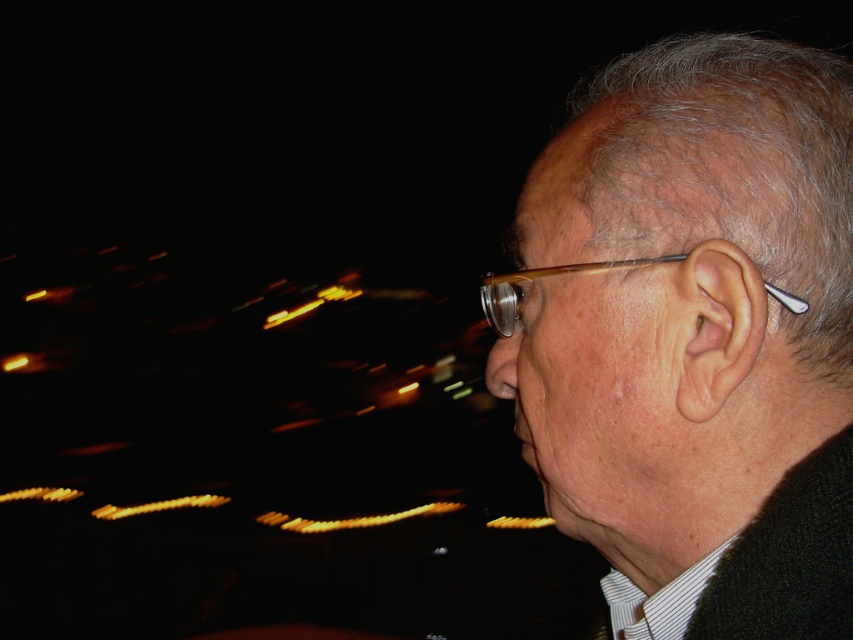
You are a photographer who just took a nighttime portrait of an older man. You notice the matte black earbud at right and the matte brown glasses at ear in the image. Based on their sizes in the photo, which object is more likely to be closer to the camera?

The matte black earbud at right is larger in size than the matte brown glasses at ear, so it is more likely to be closer to the camera.

You are a photographer reviewing a nighttime portrait. You notice the matte black earbud at right and the matte brown glasses at ear in the image. Based on their positions, which object is located farther to the right side of the photo?

The matte black earbud at right is located farther to the right side of the photo than the matte brown glasses at ear.